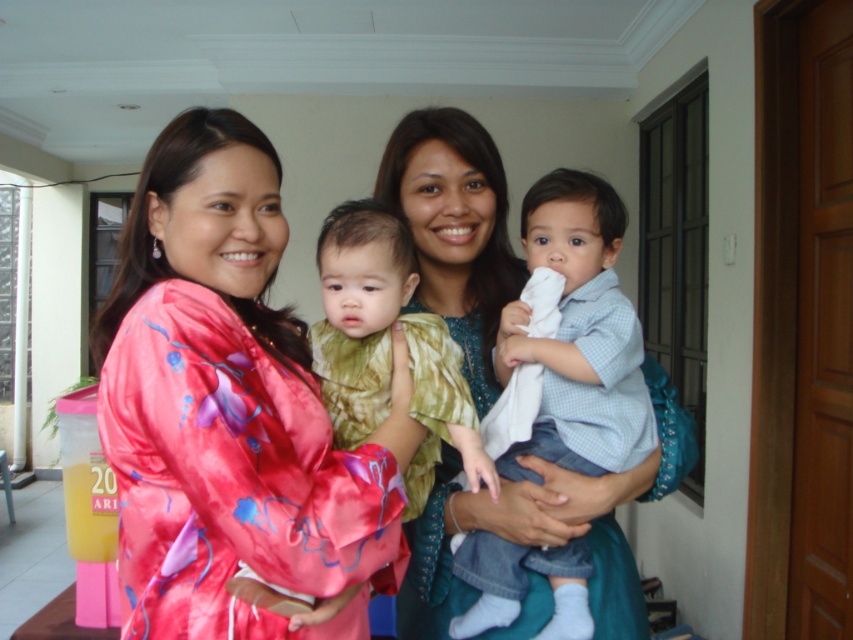
Question: Among these points, which one is farthest from the camera?

Choices:
 (A) (480, 568)
 (B) (306, 522)

Answer: (A)

Question: Can you confirm if pink satin robe at left is bigger than light blue denim shirt at center?

Choices:
 (A) no
 (B) yes

Answer: (B)

Question: Does light blue denim shirt at center appear on the left side of green textured dress at center?

Choices:
 (A) yes
 (B) no

Answer: (B)

Question: Which of the following is the closest to the observer?

Choices:
 (A) pink satin robe at left
 (B) light blue denim shirt at center
 (C) green textured dress at center

Answer: (A)

Question: Which object appears farthest from the camera in this image?

Choices:
 (A) pink satin robe at left
 (B) green textured dress at center
 (C) light blue denim shirt at center

Answer: (C)

Question: Can you confirm if pink satin robe at left is positioned to the right of green textured dress at center?

Choices:
 (A) yes
 (B) no

Answer: (B)